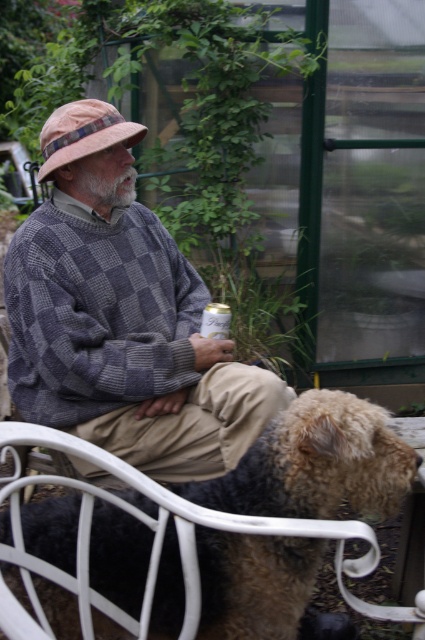
In the scene shown: You are a photographer trying to capture the man in the checkered wool sweater at center and the dog with fuzzy brown fur at lower center. Since you want to focus on the man, which subject should you adjust your camera to prioritize in terms of depth of field?

The checkered wool sweater at center is further to the viewer than the fuzzy brown fur at lower center, so you should prioritize focusing on the checkered wool sweater at center to ensure it is in sharp focus while the dog may appear slightly blurred.